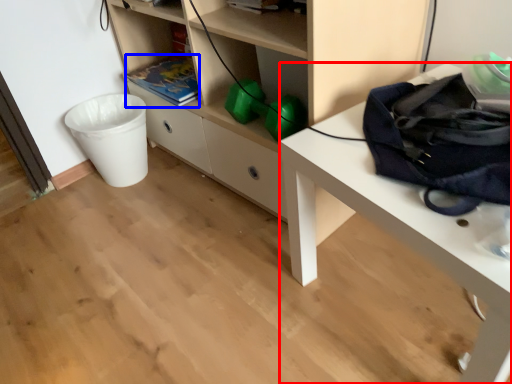
Question: Which object appears farthest to the camera in this image, desk (highlighted by a red box) or book (highlighted by a blue box)?

Choices:
 (A) desk
 (B) book

Answer: (B)